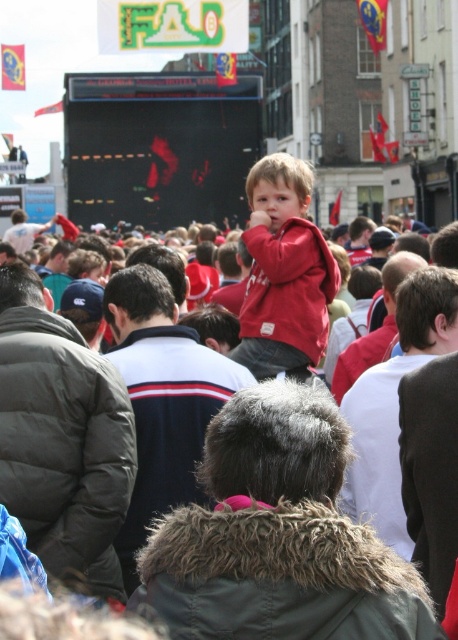
You are a photographer at the event and want to capture both the dark blue fleece jacket at center and the matte red hoodie at center in a single photo. Since you need to ensure both are fully visible, which one should you focus on to frame the shot properly?

You should focus on the dark blue fleece jacket at center because it is much taller than the matte red hoodie at center, so adjusting the frame to accommodate its height will naturally include the shorter matte red hoodie at center as well.